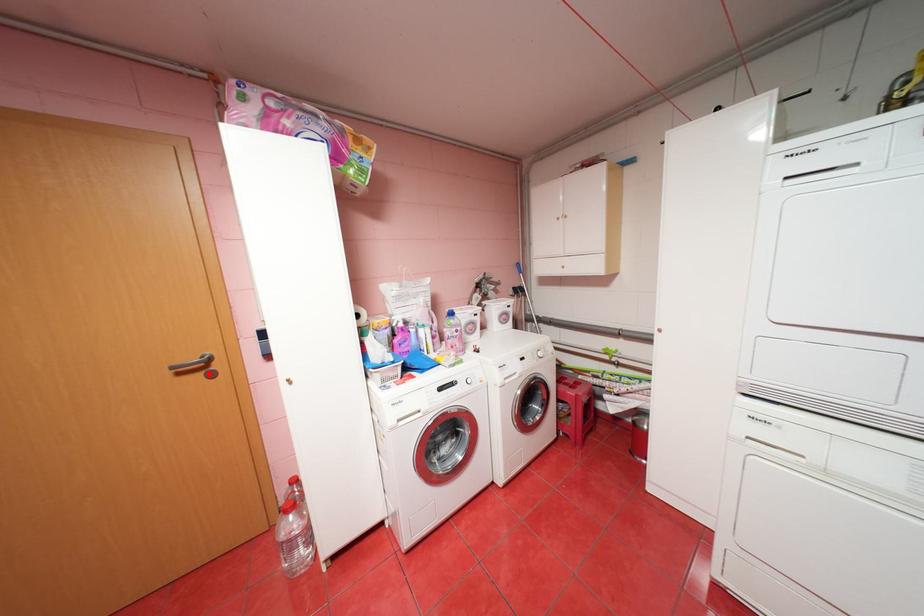
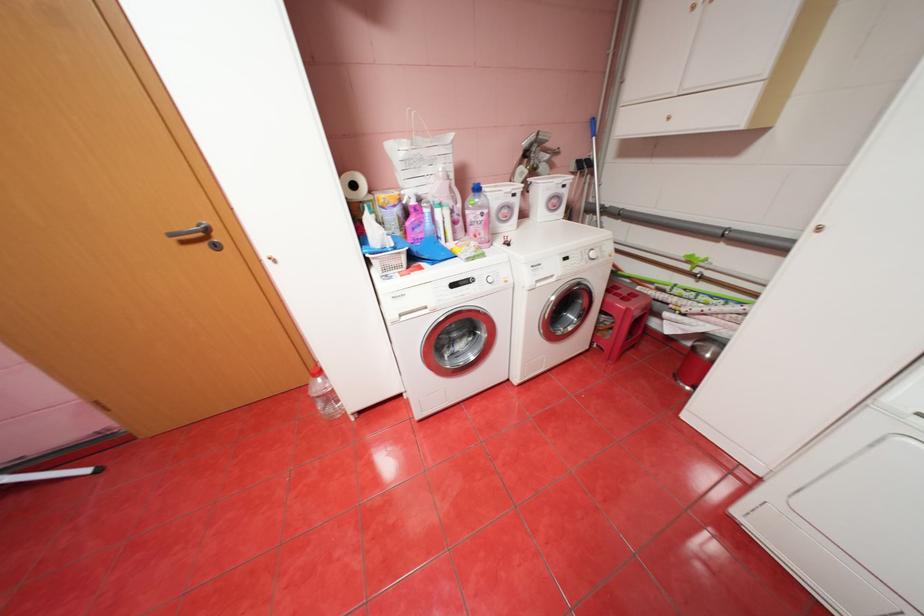
In the second image, find the point that corresponds to the highlighted location in the first image.

(213, 245)